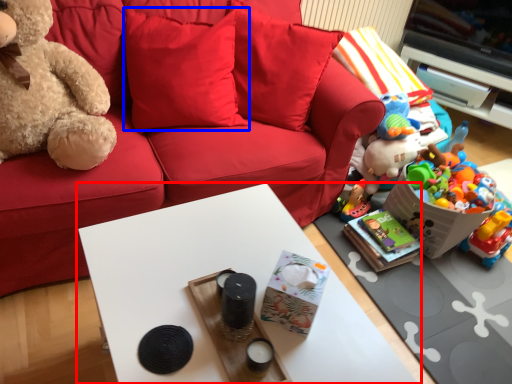
Question: Which object appears closest to the camera in this image, table (highlighted by a red box) or pillow (highlighted by a blue box)?

Choices:
 (A) table
 (B) pillow

Answer: (A)